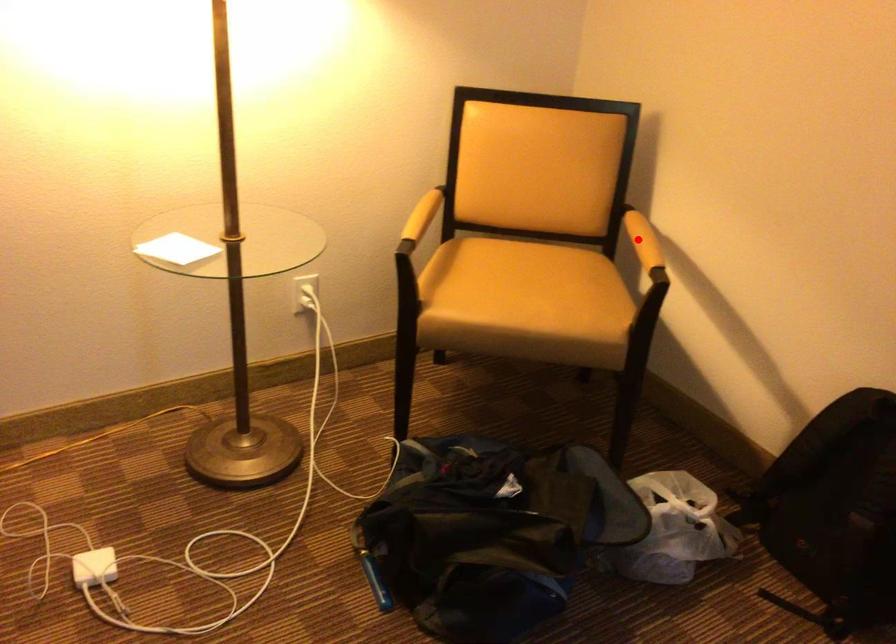
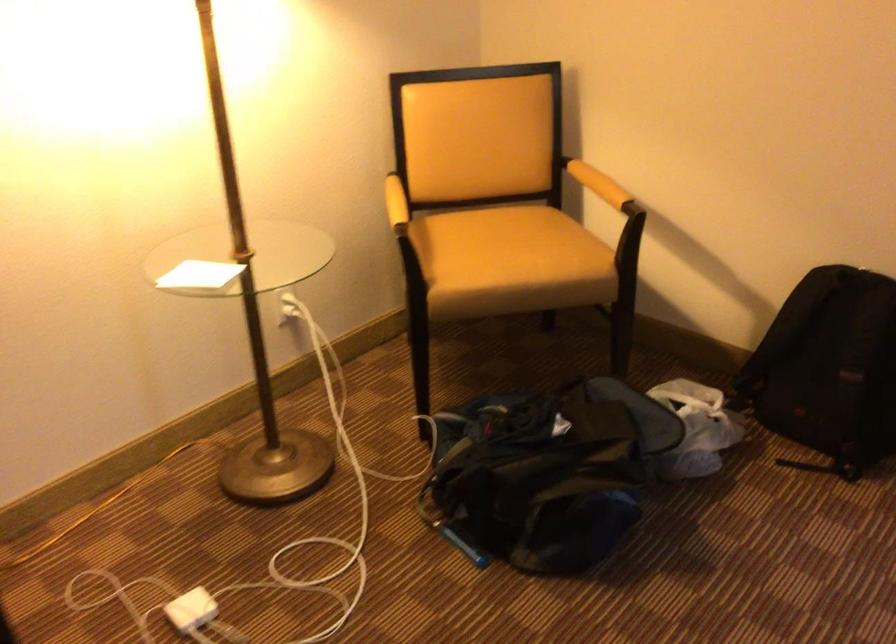
Where in the second image is the point corresponding to the highlighted location from the first image?

(598, 184)